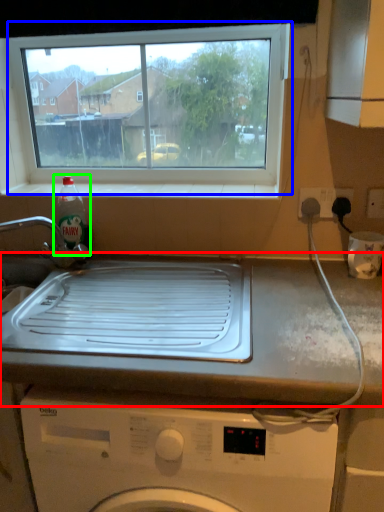
Question: Which is farther away from countertop (highlighted by a red box)? window (highlighted by a blue box) or bottle (highlighted by a green box)?

Choices:
 (A) window
 (B) bottle

Answer: (A)